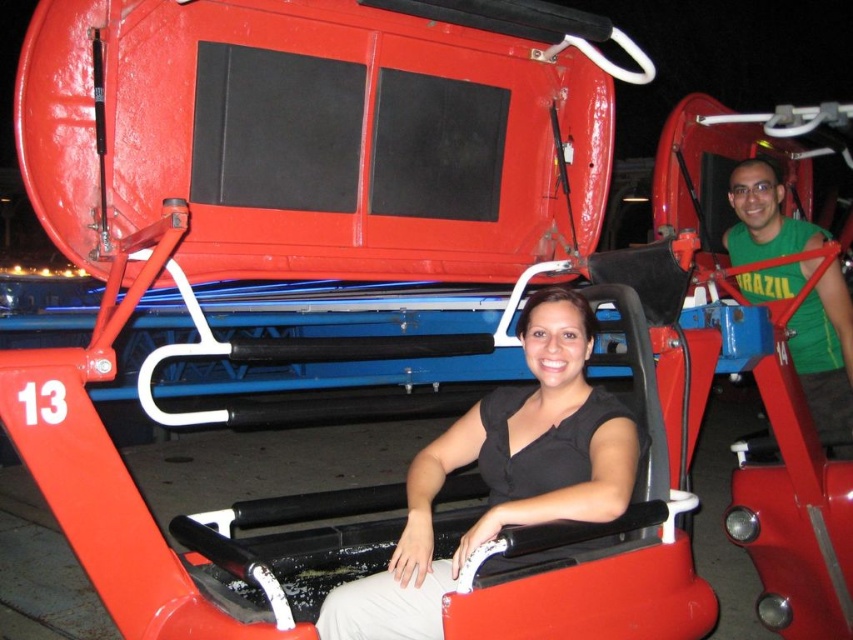
Question: Which object appears farthest from the camera in this image?

Choices:
 (A) black matte shirt at center
 (B) green fabric shirt at right

Answer: (B)

Question: Is black matte shirt at center in front of green fabric shirt at right?

Choices:
 (A) yes
 (B) no

Answer: (A)

Question: Does black matte shirt at center have a lesser width compared to green fabric shirt at right?

Choices:
 (A) no
 (B) yes

Answer: (A)

Question: Does black matte shirt at center come in front of green fabric shirt at right?

Choices:
 (A) yes
 (B) no

Answer: (A)